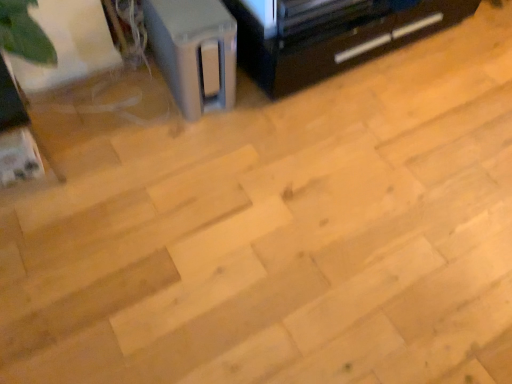
At what (x,y) coordinates should I click in order to perform the action: click on spots to the right of satin gray speaker at upper left. Please return your answer as a coordinate pair (x, y). Image resolution: width=512 pixels, height=384 pixels. Looking at the image, I should click on (263, 110).